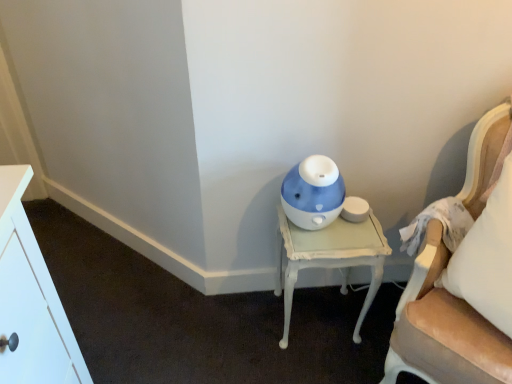
Where is `vacant region in front of white painted wood nightstand at lower right`? The image size is (512, 384). vacant region in front of white painted wood nightstand at lower right is located at coordinates (316, 364).